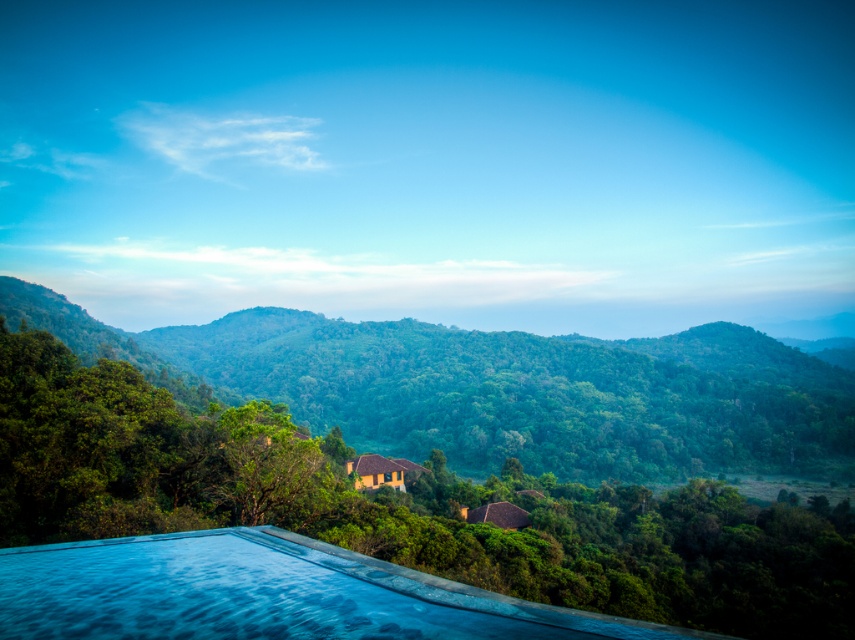
Question: Is green leafy tree at center positioned before green leafy forest at center?

Choices:
 (A) yes
 (B) no

Answer: (A)

Question: Does green leafy tree at center have a greater width compared to green leafy forest at center?

Choices:
 (A) yes
 (B) no

Answer: (B)

Question: Observing the image, what is the correct spatial positioning of green leafy tree at center in reference to green leafy forest at center?

Choices:
 (A) right
 (B) left

Answer: (A)

Question: Among these points, which one is farthest from the camera?

Choices:
 (A) (374, 518)
 (B) (523, 390)

Answer: (B)

Question: Which of the following is the closest to the observer?

Choices:
 (A) green leafy forest at center
 (B) green leafy tree at center

Answer: (B)